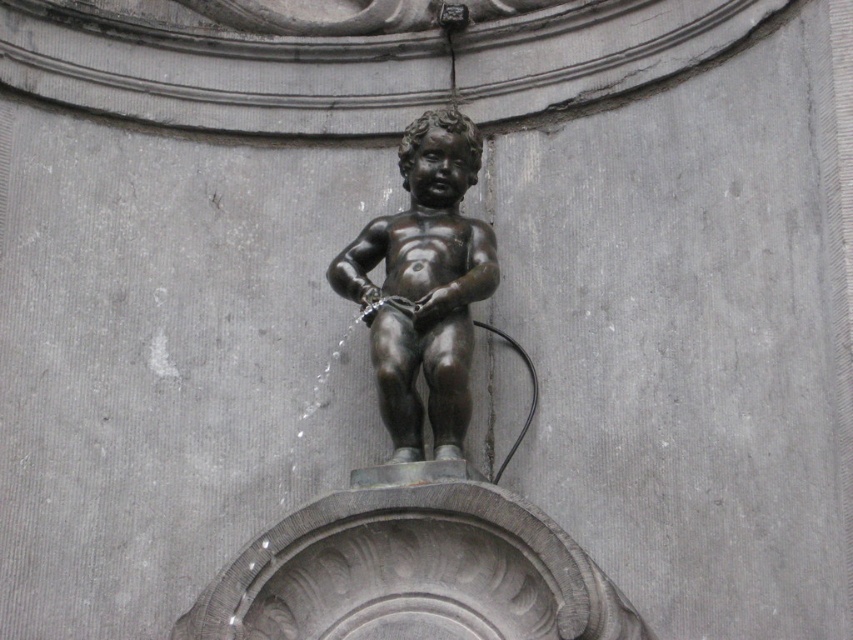
Between bronze statue at center and shiny bronze statue at center, which one appears on the left side from the viewer's perspective?

From the viewer's perspective, bronze statue at center appears more on the left side.

Who is lower down, bronze statue at center or shiny bronze statue at center?

shiny bronze statue at center is below.

This screenshot has width=853, height=640. Identify the location of bronze statue at center. (416, 461).

The image size is (853, 640). In order to click on bronze statue at center in this screenshot , I will do `click(416, 461)`.